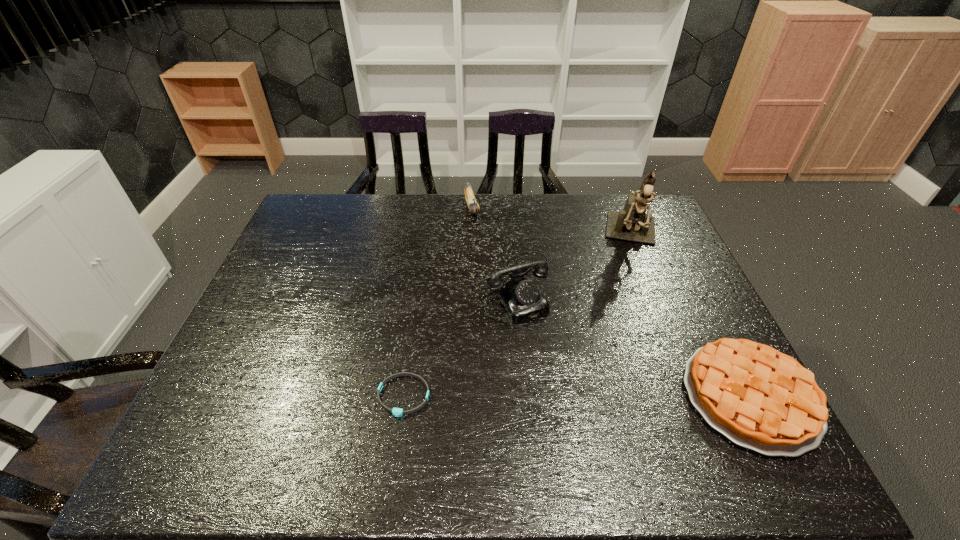
Find the location of a particular element. This screenshot has height=540, width=960. wristband is located at coordinates (397, 412).

Where is `the leftmost object`? Image resolution: width=960 pixels, height=540 pixels. the leftmost object is located at coordinates (397, 412).

The height and width of the screenshot is (540, 960). In order to click on the second shortest object in this screenshot , I will do `click(759, 398)`.

The width and height of the screenshot is (960, 540). Find the location of `telephone`. telephone is located at coordinates (522, 299).

At what (x,y) coordinates should I click in order to perform the action: click on figurine. Please return your answer as a coordinate pair (x, y). This screenshot has width=960, height=540. Looking at the image, I should click on (632, 224).

The height and width of the screenshot is (540, 960). Identify the location of banana. (473, 206).

Locate an element on the screen. Image resolution: width=960 pixels, height=540 pixels. vacant region located 0.190m on the back of the fourth tallest object is located at coordinates [x=698, y=293].

This screenshot has width=960, height=540. In order to click on vacant space situated on the front-facing side of the telephone in this screenshot , I will do `click(539, 335)`.

At what (x,y) coordinates should I click in order to perform the action: click on free space located on the front-facing side of the telephone. Please return your answer as a coordinate pair (x, y). The image size is (960, 540). Looking at the image, I should click on (545, 346).

At what (x,y) coordinates should I click in order to perform the action: click on free point located on the front-facing side of the telephone. Please return your answer as a coordinate pair (x, y). This screenshot has height=540, width=960. Looking at the image, I should click on (545, 346).